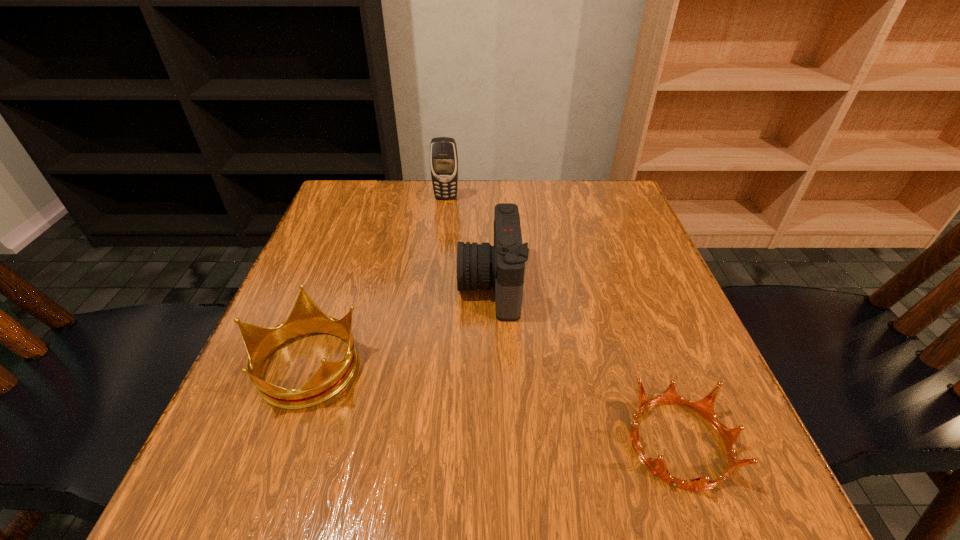
In the image, there is a desktop. What are the coordinates of `free region at the near edge` in the screenshot? It's located at (543, 515).

In the image, there is a desktop. What are the coordinates of `vacant space at the left edge` in the screenshot? It's located at (346, 274).

Image resolution: width=960 pixels, height=540 pixels. In the image, there is a desktop. What are the coordinates of `vacant region at the right edge` in the screenshot? It's located at (665, 289).

The image size is (960, 540). Identify the location of vacant space at the far left corner. (351, 187).

The image size is (960, 540). Find the location of `blank area at the far right corner`. blank area at the far right corner is located at coordinates (606, 226).

Identify the location of vacant space that is in between the right crown and the left crown. This screenshot has height=540, width=960. [x=492, y=404].

Find the location of a particular element. vacant space that's between the rightmost object and the taller crown is located at coordinates (492, 404).

The image size is (960, 540). I want to click on free space between the third object from left to right and the shortest object, so click(x=585, y=363).

Locate an element on the screen. free space between the leftmost object and the shorter crown is located at coordinates (492, 404).

Find the location of a particular element. Image resolution: width=960 pixels, height=540 pixels. free space between the left crown and the cellular telephone is located at coordinates (376, 281).